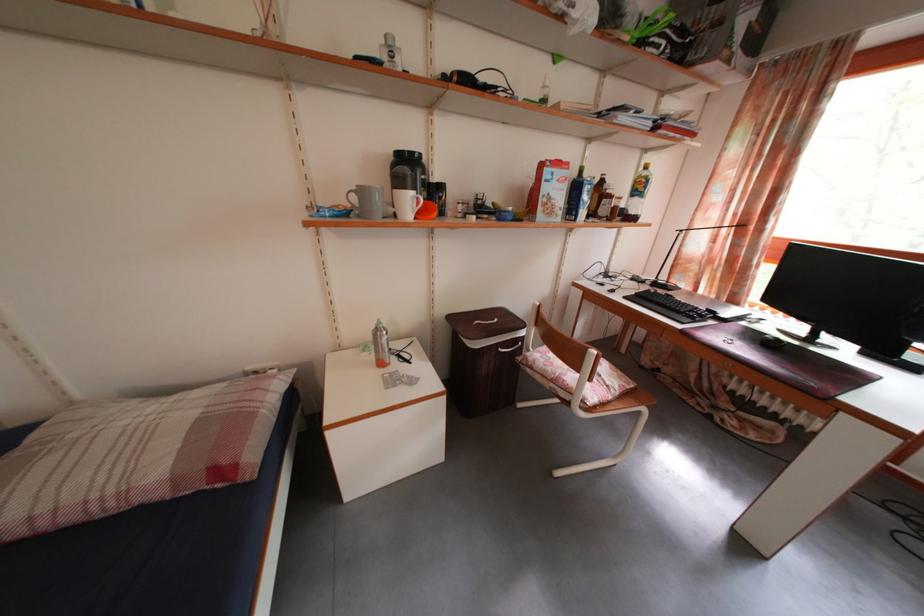
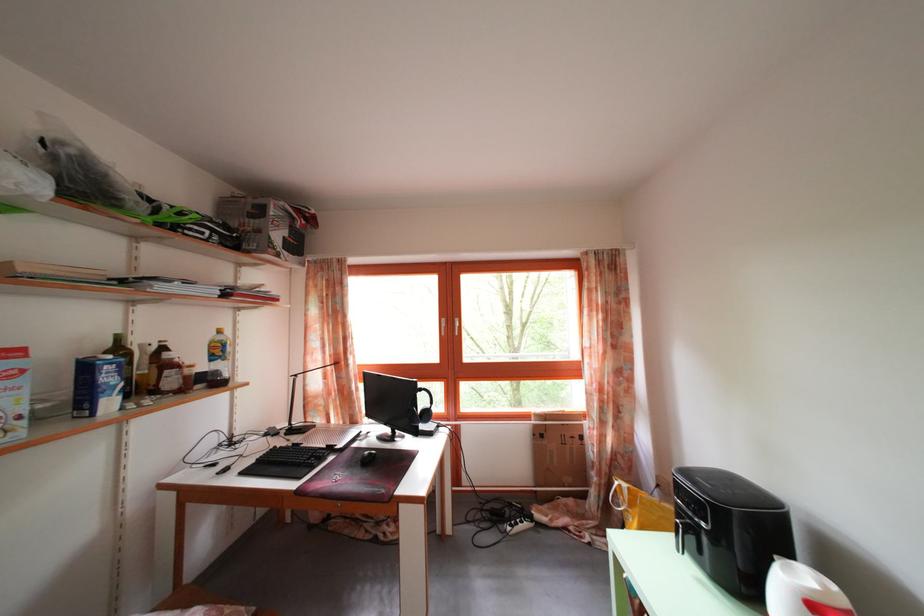
The point at (590,220) is marked in the first image. Where is the corresponding point in the second image?

(117, 410)